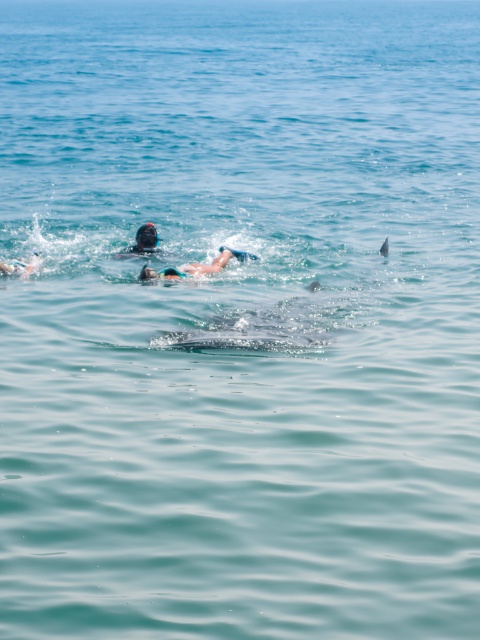
Is matte black snorkel at upper center bigger than smooth white swimmer at left?

Yes.

Which of these two, matte black snorkel at upper center or smooth white swimmer at left, stands taller?

With more height is matte black snorkel at upper center.

The width and height of the screenshot is (480, 640). Describe the element at coordinates (142, 241) in the screenshot. I see `matte black snorkel at upper center` at that location.

I want to click on matte black snorkel at upper center, so click(x=142, y=241).

Between blue matte swimsuit at center and smooth white swimmer at left, which one has less height?

smooth white swimmer at left is shorter.

Does blue matte swimsuit at center appear on the left side of smooth white swimmer at left?

In fact, blue matte swimsuit at center is to the right of smooth white swimmer at left.

Find the location of `blue matte swimsuit at center`. blue matte swimsuit at center is located at coordinates (x=196, y=266).

Who is lower down, blue matte swimsuit at center or matte black snorkel at upper center?

Positioned lower is blue matte swimsuit at center.

You are a GUI agent. You are given a task and a screenshot of the screen. Output one action in this format:
    pyautogui.click(x=<x>, y=<y>)
    Task: Click on the blue matte swimsuit at center
    Image resolution: width=480 pixels, height=640 pixels.
    Given the screenshot: What is the action you would take?
    pyautogui.click(x=196, y=266)